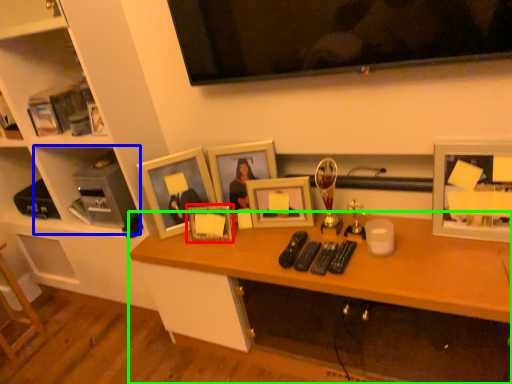
Question: Which object is the farthest from picture frame (highlighted by a red box)? Choose among these: cabinet (highlighted by a blue box) or desk (highlighted by a green box).

Choices:
 (A) cabinet
 (B) desk

Answer: (A)